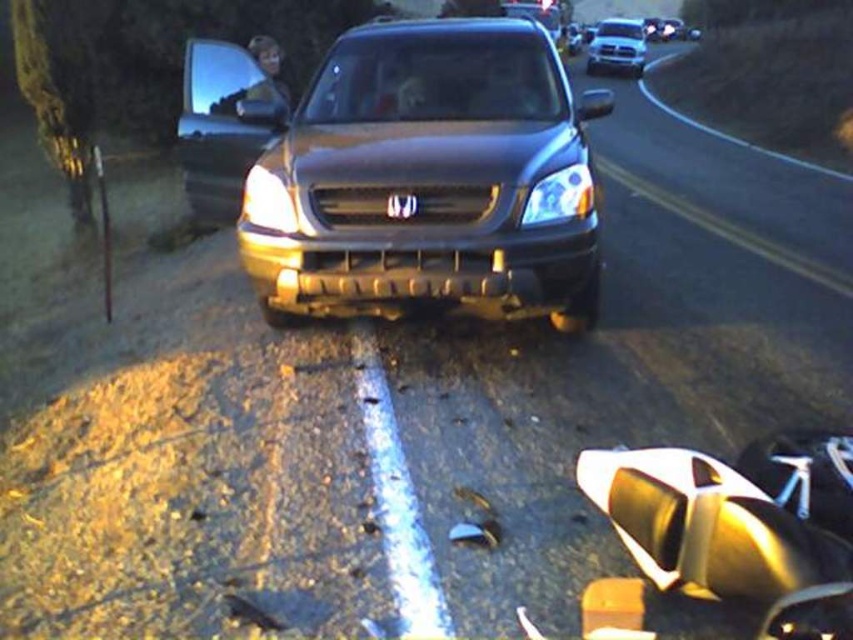
Does matte plastic headlight at center have a larger size compared to silver metallic truck at upper center?

Actually, matte plastic headlight at center might be smaller than silver metallic truck at upper center.

Is point (532, 225) positioned behind point (643, 49)?

No.

I want to click on matte plastic headlight at center, so click(x=560, y=196).

Based on the photo, is satin black suv at center thinner than silver metallic truck at upper center?

Yes, satin black suv at center is thinner than silver metallic truck at upper center.

Can you confirm if satin black suv at center is smaller than silver metallic truck at upper center?

Correct, satin black suv at center occupies less space than silver metallic truck at upper center.

Describe the element at coordinates (401, 172) in the screenshot. I see `satin black suv at center` at that location.

I want to click on satin black suv at center, so click(401, 172).

Which is behind, point (614, 19) or point (273, 172)?

The point (614, 19) is behind.

What do you see at coordinates (616, 45) in the screenshot? I see `silver metallic truck at upper center` at bounding box center [616, 45].

Locate an element on the screen. Image resolution: width=853 pixels, height=640 pixels. silver metallic truck at upper center is located at coordinates (616, 45).